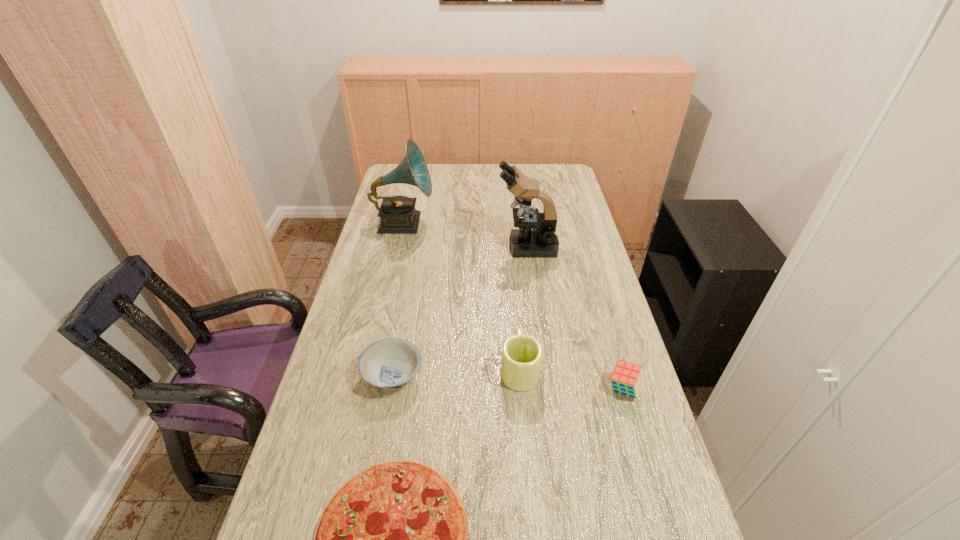
The height and width of the screenshot is (540, 960). What are the coordinates of `vacant area situated 0.160m with the handle on the side of the mug` in the screenshot? It's located at (515, 307).

Find the location of a particular element. vacant region located 0.170m on the back of the fourth tallest object is located at coordinates (606, 328).

Identify the location of vacant space located on the front of the second shortest object. (366, 525).

What are the coordinates of `phonograph_record that is at the left edge` in the screenshot? It's located at (397, 213).

Locate an element on the screen. This screenshot has width=960, height=540. bowl that is positioned at the left edge is located at coordinates (389, 364).

I want to click on microscope situated at the right edge, so click(536, 237).

Where is `cube that is positioned at the right edge`? The image size is (960, 540). cube that is positioned at the right edge is located at coordinates (627, 378).

This screenshot has height=540, width=960. Identify the location of blank space at the far edge of the desktop. click(x=499, y=183).

Where is `vacant point at the left edge`? The height and width of the screenshot is (540, 960). vacant point at the left edge is located at coordinates (405, 255).

The width and height of the screenshot is (960, 540). I want to click on vacant position at the right edge of the desktop, so click(614, 458).